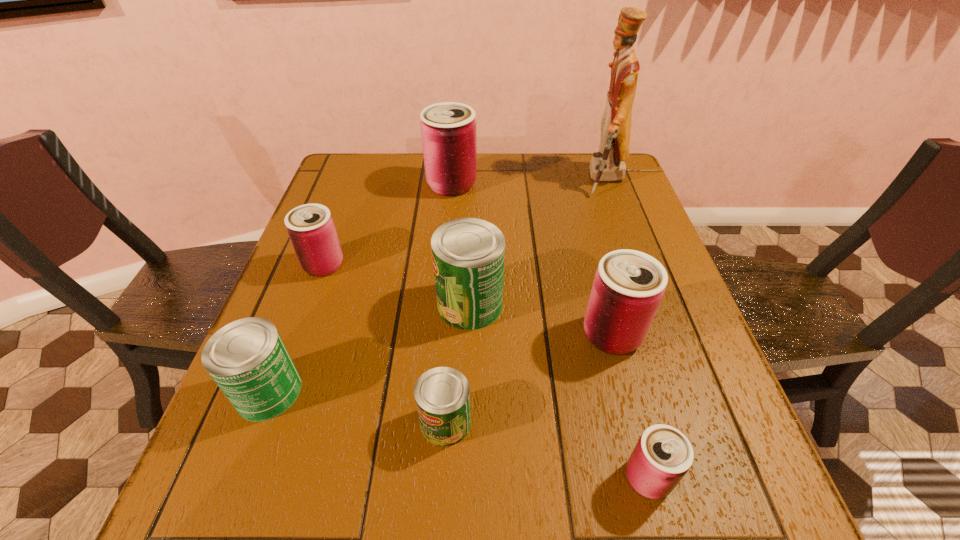
The image size is (960, 540). I want to click on vacant space located 0.180m on the left of the smallest green can, so click(x=316, y=423).

This screenshot has width=960, height=540. In order to click on free spot located on the back of the nearest can in this screenshot , I will do `click(600, 297)`.

You are a GUI agent. You are given a task and a screenshot of the screen. Output one action in this format:
    pyautogui.click(x=<x>, y=<y>)
    Task: Click on the nutcracker positioned at the far edge
    The image size is (960, 540).
    Given the screenshot: What is the action you would take?
    pyautogui.click(x=608, y=164)

The image size is (960, 540). In order to click on can present at the far edge in this screenshot , I will do `click(448, 129)`.

I want to click on object that is positioned at the near edge, so click(x=662, y=456).

Identify the location of nutcracker situated at the right edge. The height and width of the screenshot is (540, 960). (608, 164).

Identify the location of object that is at the far right corner. The height and width of the screenshot is (540, 960). (608, 164).

At what (x,y) coordinates should I click in order to perform the action: click on object at the near right corner. Please return your answer as a coordinate pair (x, y). Looking at the image, I should click on (662, 456).

Where is `vacant space at the far edge of the desktop`? This screenshot has width=960, height=540. vacant space at the far edge of the desktop is located at coordinates (568, 178).

The image size is (960, 540). I want to click on vacant area at the near edge, so (x=398, y=476).